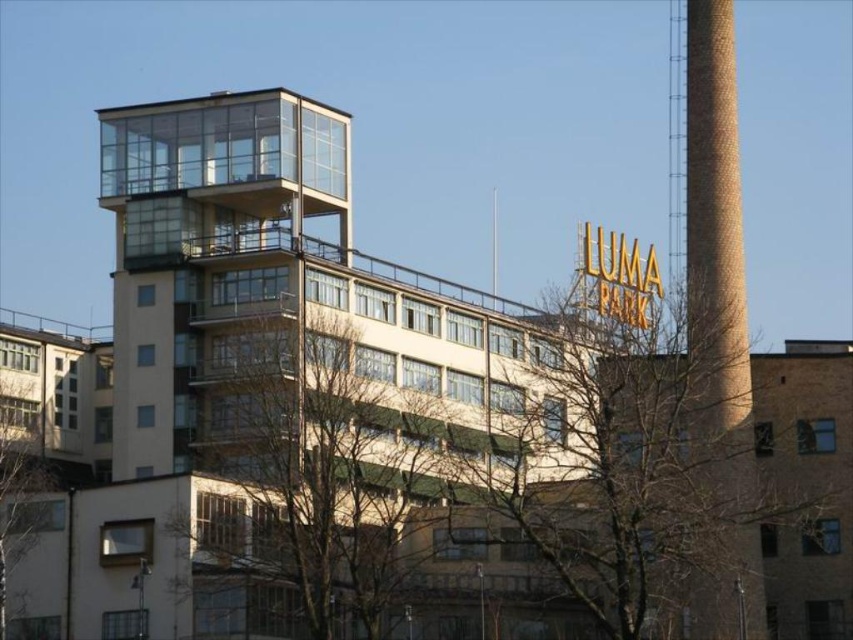
Can you confirm if brown brick chimney at right is positioned above bare branches at left?

Indeed, brown brick chimney at right is positioned over bare branches at left.

Which is more to the left, brown brick chimney at right or bare branches at left?

bare branches at left is more to the left.

Is point (712, 244) positioned after point (22, 524)?

No.

I want to click on brown brick chimney at right, so click(712, 236).

Can you confirm if bare branches at upper center is positioned to the left of bare branches at center?

Incorrect, bare branches at upper center is not on the left side of bare branches at center.

From the picture: Can you confirm if bare branches at upper center is wider than bare branches at center?

Yes, bare branches at upper center is wider than bare branches at center.

Is point (450, 493) farther from viewer compared to point (396, 400)?

No, (450, 493) is in front of (396, 400).

In order to click on bare branches at upper center in this screenshot , I will do `click(679, 477)`.

Can you confirm if bare branches at center is positioned to the left of bare branches at left?

Incorrect, bare branches at center is not on the left side of bare branches at left.

Can you confirm if bare branches at center is bigger than bare branches at left?

Yes, bare branches at center is bigger than bare branches at left.

Where is `bare branches at center`? The image size is (853, 640). bare branches at center is located at coordinates point(325,461).